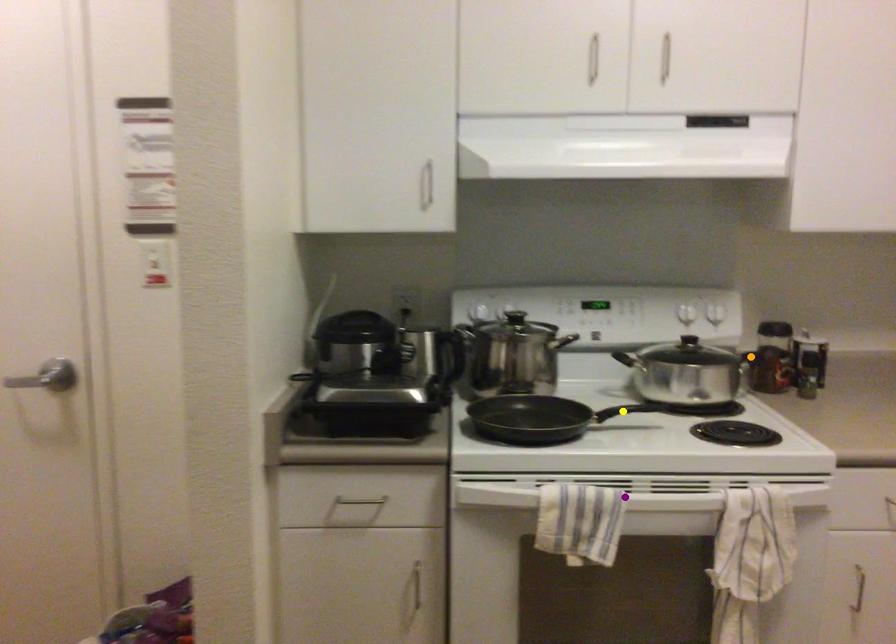
Order these from nearest to farthest:
orange point | purple point | yellow point

purple point
yellow point
orange point